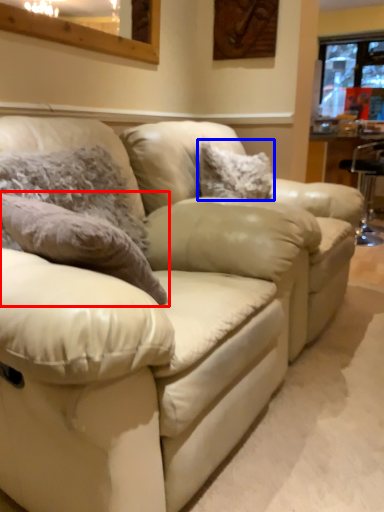
Question: Which of the following is the closest to the observer, pillow (highlighted by a red box) or pillow (highlighted by a blue box)?

Choices:
 (A) pillow
 (B) pillow

Answer: (A)